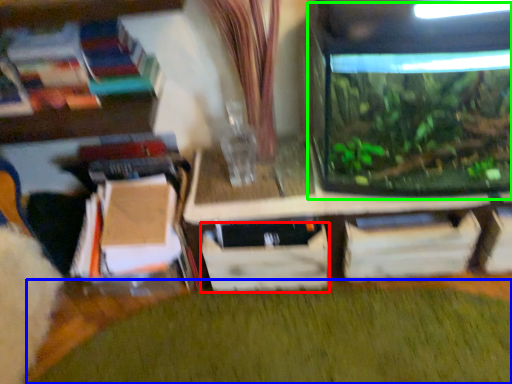
Question: Estimate the real-world distances between objects in this image. Which object is farther from drawer (highlighted by a red box), plant (highlighted by a blue box) or glass box (highlighted by a green box)?

Choices:
 (A) plant
 (B) glass box

Answer: (B)